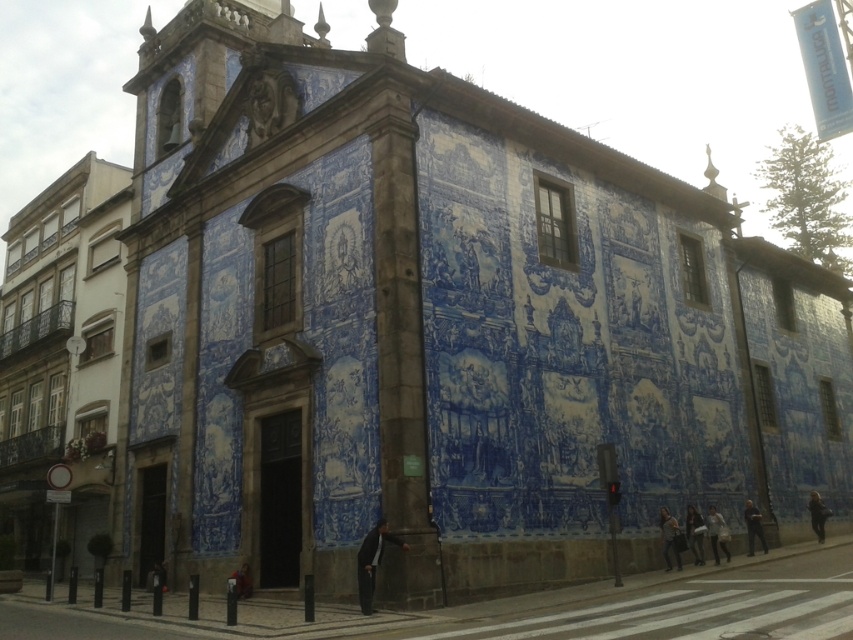
Question: Which point is closer to the camera?

Choices:
 (A) coord(747,524)
 (B) coord(718,513)

Answer: (A)

Question: Which object is positioned farthest from the dark gray fabric jacket at lower right?

Choices:
 (A) light brown leather jacket at lower right
 (B) dark blue fabric jacket at center
 (C) black fabric at lower right
 (D) dark gray suit at lower center

Answer: (B)

Question: Is light gray fabric jacket at lower right to the left of dark blue fabric jacket at center from the viewer's perspective?

Choices:
 (A) yes
 (B) no

Answer: (B)

Question: Estimate the real-world distances between objects in this image. Which object is farther from the dark gray suit at lower center?

Choices:
 (A) light brown leather jacket at lower right
 (B) black fabric at lower right
 (C) dark blue fabric jacket at center

Answer: (B)

Question: Can you confirm if blue glazed tiles at left is wider than black fabric at lower right?

Choices:
 (A) no
 (B) yes

Answer: (B)

Question: Can you confirm if blue glazed tiles at left is thinner than black fabric at lower right?

Choices:
 (A) no
 (B) yes

Answer: (A)